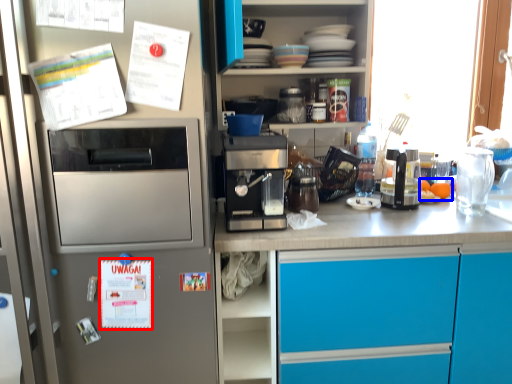
Question: Which object appears farthest to the camera in this image, postcard (highlighted by a red box) or food (highlighted by a blue box)?

Choices:
 (A) postcard
 (B) food

Answer: (B)